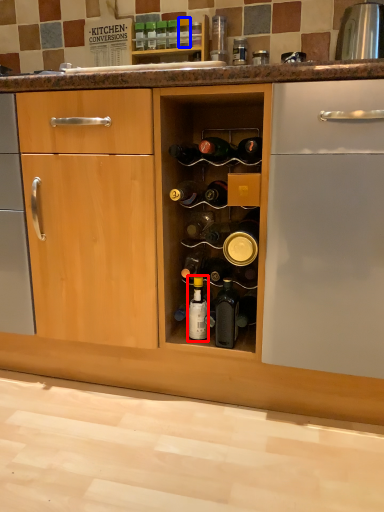
Question: Which object is closer to the camera taking this photo, bottle (highlighted by a red box) or bottle (highlighted by a blue box)?

Choices:
 (A) bottle
 (B) bottle

Answer: (A)